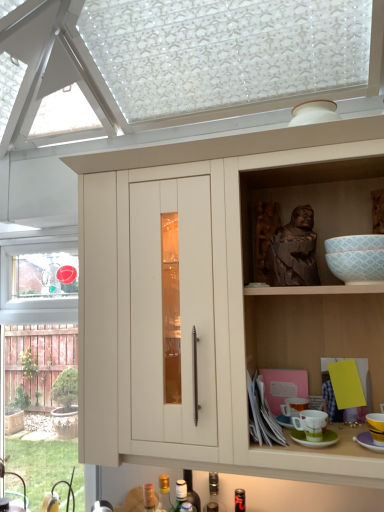
In the scene shown: What is the approximate height of metallic glass bottle at lower center, the fourth bottle positioned from the left?

It is 12.18 inches.

The image size is (384, 512). What do you see at coordinates (149, 498) in the screenshot?
I see `translucent glass bottle at lower center, acting as the first bottle starting from the left` at bounding box center [149, 498].

Identify the location of translucent glass bottle at lower center, which is the 2th bottle from left to right. The width and height of the screenshot is (384, 512). (164, 494).

Describe the element at coordinates (164, 494) in the screenshot. This screenshot has width=384, height=512. I see `translucent glass bottle at lower center, which is the 2th bottle from left to right` at that location.

How much space does translucent glass bottle at lower center, acting as the 2th bottle starting from the right, occupy vertically?

translucent glass bottle at lower center, acting as the 2th bottle starting from the right, is 12.20 inches tall.

Locate an element on the screen. translucent glass bottle at lower center, positioned as the 3th bottle in left-to-right order is located at coordinates (181, 496).

At what (x,y) coordinates should I click in order to perform the action: click on metallic glass bottle at lower center, arranged as the first bottle when viewed from the right. Please return your answer as a coordinate pair (x, y). Looking at the image, I should click on (214, 492).

Consider the image. Based on their sizes in the image, would you say yellow matte cup at lower right, positioned as the first tableware in right-to-left order, is bigger or smaller than metallic glass bottle at lower center, the fourth bottle positioned from the left?

Clearly, yellow matte cup at lower right, positioned as the first tableware in right-to-left order, is smaller in size than metallic glass bottle at lower center, the fourth bottle positioned from the left.

This screenshot has width=384, height=512. There is a metallic glass bottle at lower center, the fourth bottle positioned from the left. In order to click on the 2nd tableware above it (from the image's perspective) in this screenshot , I will do `click(376, 426)`.

Which object is wider, yellow matte cup at lower right, the 2th tableware when ordered from left to right, or metallic glass bottle at lower center, arranged as the first bottle when viewed from the right?

Wider between the two is yellow matte cup at lower right, the 2th tableware when ordered from left to right.

Considering the positions of objects translucent glass bottle at lower center, the 3th bottle in the right-to-left sequence, and green matte saucer at lower right, positioned as the first saucer in right-to-left order, in the image provided, who is in front, translucent glass bottle at lower center, the 3th bottle in the right-to-left sequence, or green matte saucer at lower right, positioned as the first saucer in right-to-left order,?

Positioned in front is green matte saucer at lower right, positioned as the first saucer in right-to-left order.

Is translucent glass bottle at lower center, which is the 2th bottle from left to right, wider or thinner than green matte saucer at lower right, positioned as the first saucer in right-to-left order?

Considering their sizes, translucent glass bottle at lower center, which is the 2th bottle from left to right, looks slimmer than green matte saucer at lower right, positioned as the first saucer in right-to-left order.

Consider the image. Which object is positioned more to the left, translucent glass bottle at lower center, which is the 2th bottle from left to right, or green matte saucer at lower right, positioned as the first saucer in right-to-left order?

translucent glass bottle at lower center, which is the 2th bottle from left to right.

From a real-world perspective, between translucent glass bottle at lower center, the 3th bottle in the right-to-left sequence, and green matte saucer at lower right, arranged as the second saucer when viewed from the left, who is vertically lower?

From a 3D spatial view, translucent glass bottle at lower center, the 3th bottle in the right-to-left sequence, is below.

Which is less distant, (141, 340) or (381, 449)?

Point (141, 340) is farther from the camera than point (381, 449).

From the image's perspective, which object appears higher, matte wood cabinet at center or green matte saucer at lower right, positioned as the first saucer in right-to-left order?

matte wood cabinet at center is shown above in the image.

Between matte wood cabinet at center and green matte saucer at lower right, arranged as the second saucer when viewed from the left, which one has less height?

With less height is green matte saucer at lower right, arranged as the second saucer when viewed from the left.

Can you tell me how much matte wood cabinet at center and green matte saucer at lower right, positioned as the first saucer in right-to-left order, differ in facing direction?

The facing directions of matte wood cabinet at center and green matte saucer at lower right, positioned as the first saucer in right-to-left order, are 0.493 degrees apart.

Where is `the 1st tableware positioned above the metallic glass bottle at lower center, the fourth bottle positioned from the left (from a real-world perspective)`? This screenshot has height=512, width=384. the 1st tableware positioned above the metallic glass bottle at lower center, the fourth bottle positioned from the left (from a real-world perspective) is located at coordinates (311, 424).

Consider the image. Which of these two, metallic glass bottle at lower center, the fourth bottle positioned from the left, or matte ceramic mug at lower right, the 2th tableware viewed from the right, is bigger?

Bigger between the two is metallic glass bottle at lower center, the fourth bottle positioned from the left.

Is metallic glass bottle at lower center, the fourth bottle positioned from the left, positioned beyond the bounds of matte ceramic mug at lower right, marked as the first tableware in a left-to-right arrangement?

Absolutely, metallic glass bottle at lower center, the fourth bottle positioned from the left, is external to matte ceramic mug at lower right, marked as the first tableware in a left-to-right arrangement.

Between translucent glass bottle at lower center, positioned as the 3th bottle in left-to-right order, and white glossy bowl at upper right, which one appears on the right side from the viewer's perspective?

white glossy bowl at upper right.

From the image's perspective, is translucent glass bottle at lower center, positioned as the 3th bottle in left-to-right order, positioned above or below white glossy bowl at upper right?

Based on their image positions, translucent glass bottle at lower center, positioned as the 3th bottle in left-to-right order, is located beneath white glossy bowl at upper right.

Can you tell me how much translucent glass bottle at lower center, positioned as the 3th bottle in left-to-right order, and white glossy bowl at upper right differ in facing direction?

A: translucent glass bottle at lower center, positioned as the 3th bottle in left-to-right order, and white glossy bowl at upper right are facing 1.45 degrees away from each other.

Looking at this image, does translucent glass bottle at lower center, acting as the 2th bottle starting from the right, have a lesser width compared to white glossy bowl at upper right?

Indeed, translucent glass bottle at lower center, acting as the 2th bottle starting from the right, has a lesser width compared to white glossy bowl at upper right.

Considering the sizes of objects metallic glass bottle at lower center, the fourth bottle positioned from the left, and matte wood cabinet at center in the image provided, who is wider, metallic glass bottle at lower center, the fourth bottle positioned from the left, or matte wood cabinet at center?

matte wood cabinet at center.

From a real-world perspective, which object rests below the other?

In real-world perspective, metallic glass bottle at lower center, the fourth bottle positioned from the left, is lower.

Is metallic glass bottle at lower center, the fourth bottle positioned from the left, oriented towards matte wood cabinet at center?

No, metallic glass bottle at lower center, the fourth bottle positioned from the left, does not turn towards matte wood cabinet at center.

Does matte wood cabinet at center lie in front of green matte saucer at lower right, the second saucer when ordered from right to left?

That is True.

Is matte wood cabinet at center smaller than green matte saucer at lower right, the first saucer when ordered from left to right?

No.

Find the location of `cabinetry in front of the green matte saucer at lower right, the first saucer when ordered from left to right`. cabinetry in front of the green matte saucer at lower right, the first saucer when ordered from left to right is located at coordinates (214, 303).

Starting from the yellow matte cup at lower right, the 2th tableware when ordered from left to right, which bottle is the 4th one behind? Please provide its 2D coordinates.

[(214, 492)]

Locate an element on the screen. the 2nd saucer to the right when counting from the translucent glass bottle at lower center, which is the 2th bottle from left to right is located at coordinates (368, 442).

Based on their spatial positions, is brown wooden statue at upper right or translucent glass bottle at lower center, positioned as the 3th bottle in left-to-right order, closer to matte ceramic mug at lower right, the 2th tableware viewed from the right?

Among the two, brown wooden statue at upper right is located nearer to matte ceramic mug at lower right, the 2th tableware viewed from the right.

From the image, which object appears to be nearer to translucent glass bottle at lower center, acting as the 2th bottle starting from the right, translucent glass bottle at lower center, the 3th bottle in the right-to-left sequence, or brown wooden statue at upper right?

Based on the image, translucent glass bottle at lower center, the 3th bottle in the right-to-left sequence, appears to be nearer to translucent glass bottle at lower center, acting as the 2th bottle starting from the right.

Which object lies further to the anchor point matte wood cabinet at center, metallic glass bottle at lower center, the fourth bottle positioned from the left, or green matte saucer at lower right, arranged as the second saucer when viewed from the left?

A: Based on the image, metallic glass bottle at lower center, the fourth bottle positioned from the left, appears to be further to matte wood cabinet at center.

Considering their positions, is metallic glass bottle at lower center, arranged as the first bottle when viewed from the right, positioned further to white glossy bowl at upper right than translucent glass bottle at lower center, which is the 2th bottle from left to right?

translucent glass bottle at lower center, which is the 2th bottle from left to right, is further to white glossy bowl at upper right.

Looking at this image, from the image, which object appears to be nearer to brown wooden statue at upper right, yellow matte cup at lower right, positioned as the first tableware in right-to-left order, or matte wood cabinet at center?

matte wood cabinet at center.

Estimate the real-world distances between objects in this image. Which object is further from translucent glass bottle at lower center, acting as the 2th bottle starting from the right, white glossy bowl at upper right or matte ceramic mug at lower right, the 2th tableware viewed from the right?

white glossy bowl at upper right.

Looking at the image, which one is located further to white glossy bowl at upper right, brown wooden statue at upper right or translucent glass bottle at lower center, positioned as the 3th bottle in left-to-right order?

translucent glass bottle at lower center, positioned as the 3th bottle in left-to-right order, is positioned further to the anchor white glossy bowl at upper right.

Considering their positions, is metallic glass bottle at lower center, the fourth bottle positioned from the left, positioned closer to matte wood cabinet at center than matte ceramic mug at lower right, the 2th tableware viewed from the right?

Based on the image, matte ceramic mug at lower right, the 2th tableware viewed from the right, appears to be nearer to matte wood cabinet at center.

Locate an element on the screen. This screenshot has width=384, height=512. person between brown wooden statue at upper right and metallic glass bottle at lower center, arranged as the first bottle when viewed from the right, vertically is located at coordinates tap(293, 251).

Find the location of `tableware between translucent glass bottle at lower center, acting as the first bottle starting from the left, and green matte saucer at lower right, the second saucer when ordered from right to left`. tableware between translucent glass bottle at lower center, acting as the first bottle starting from the left, and green matte saucer at lower right, the second saucer when ordered from right to left is located at coordinates (311, 424).

Where is `mixing bowl between brown wooden statue at upper right and yellow matte cup at lower right, the 2th tableware when ordered from left to right, vertically`? The image size is (384, 512). mixing bowl between brown wooden statue at upper right and yellow matte cup at lower right, the 2th tableware when ordered from left to right, vertically is located at coordinates (356, 257).

Where is `saucer between brown wooden statue at upper right and green matte saucer at lower right, the second saucer when ordered from right to left, in the vertical direction`? This screenshot has width=384, height=512. saucer between brown wooden statue at upper right and green matte saucer at lower right, the second saucer when ordered from right to left, in the vertical direction is located at coordinates (368, 442).